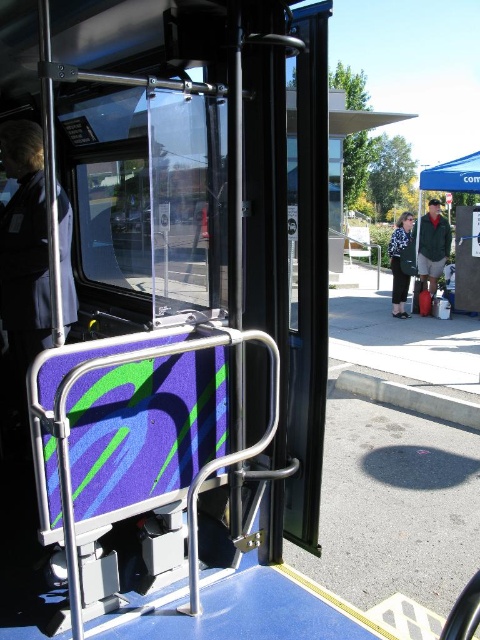
Question: Which of the following is the closest to the observer?

Choices:
 (A) (395, 262)
 (B) (457, 180)

Answer: (A)

Question: Can you confirm if gray concrete curb at lower right is positioned to the left of blue fabric canopy at upper right?

Choices:
 (A) yes
 (B) no

Answer: (A)

Question: Can you confirm if gray concrete curb at lower right is wider than patterned fabric jacket at center?

Choices:
 (A) no
 (B) yes

Answer: (B)

Question: Which object is the closest to the blue fabric canopy at upper right?

Choices:
 (A) gray concrete curb at lower right
 (B) green fabric jacket at center

Answer: (B)

Question: Among these objects, which one is farthest from the camera?

Choices:
 (A) gray concrete curb at lower right
 (B) green fabric tent at right

Answer: (B)

Question: From the image, what is the correct spatial relationship of green fabric tent at right in relation to blue fabric canopy at upper right?

Choices:
 (A) right
 (B) left

Answer: (B)